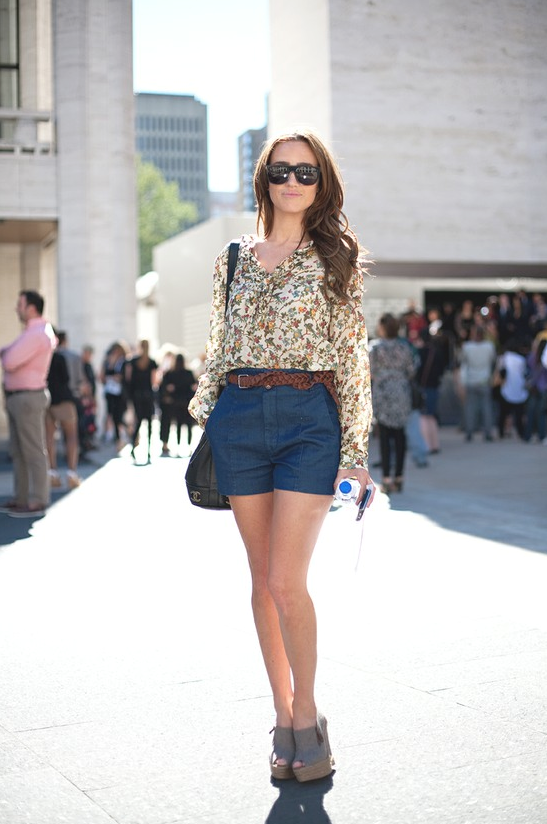
Identify the location of floor. (445, 689).